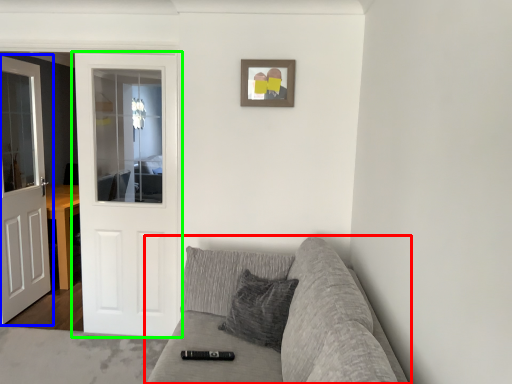
Question: Which object is the farthest from studio couch (highlighted by a red box)? Choose among these: door (highlighted by a blue box) or door (highlighted by a green box).

Choices:
 (A) door
 (B) door

Answer: (B)